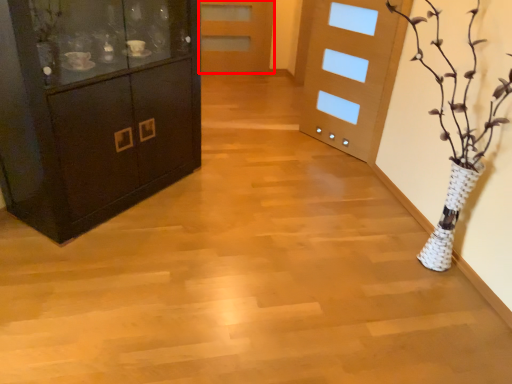
Question: Considering the relative positions of door (annotated by the red box) and cabinetry in the image provided, where is door (annotated by the red box) located with respect to the staircase?

Choices:
 (A) right
 (B) left

Answer: (A)